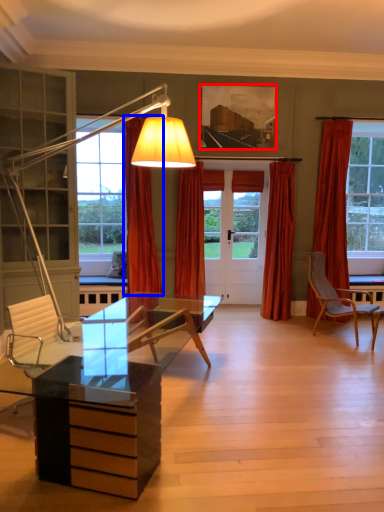
Question: Which of the following is the closest to the observer, picture frame (highlighted by a red box) or curtain (highlighted by a blue box)?

Choices:
 (A) picture frame
 (B) curtain

Answer: (B)